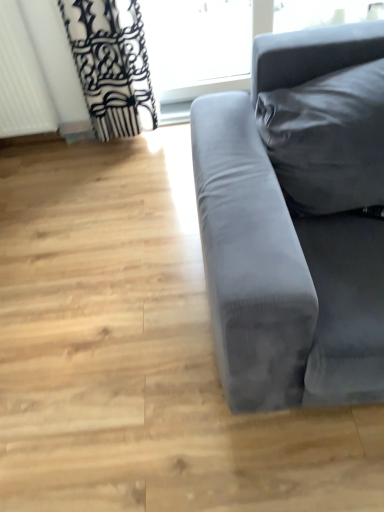
The height and width of the screenshot is (512, 384). Identify the location of vacant area situated below white textured radiator at left (from a real-world perspective). (31, 142).